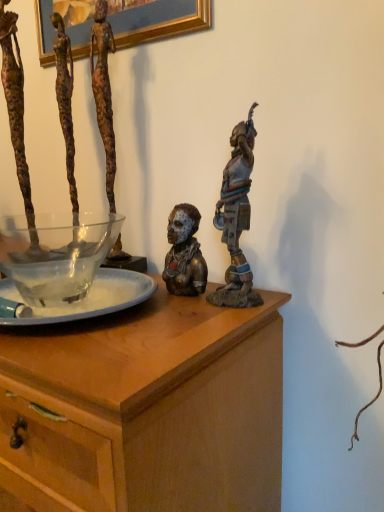
Where is `free space in front of bronze statue at upper right, which ranks as the 4th person in left-to-right order`? The height and width of the screenshot is (512, 384). free space in front of bronze statue at upper right, which ranks as the 4th person in left-to-right order is located at coordinates (200, 330).